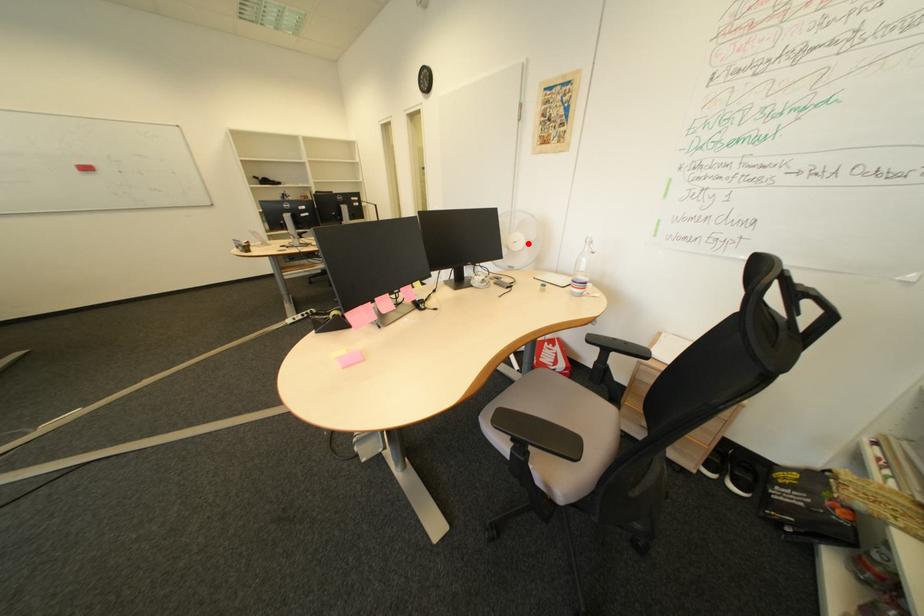
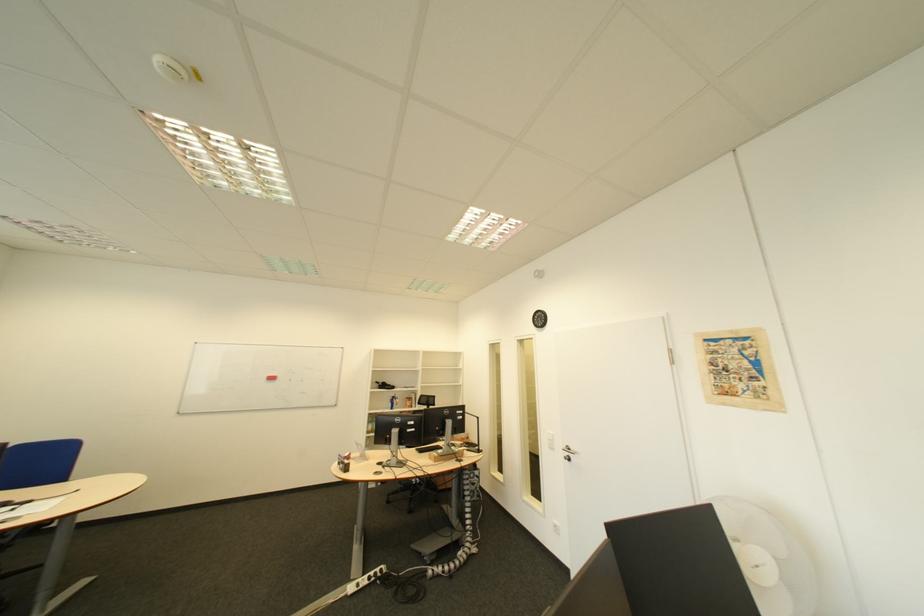
Question: I am providing you with two images of the same scene from different viewpoints. In image1, a red point is highlighted. Considering the same 3D point in image2, which of the following is correct?

Choices:
 (A) It is closer
 (B) It is farther

Answer: (A)